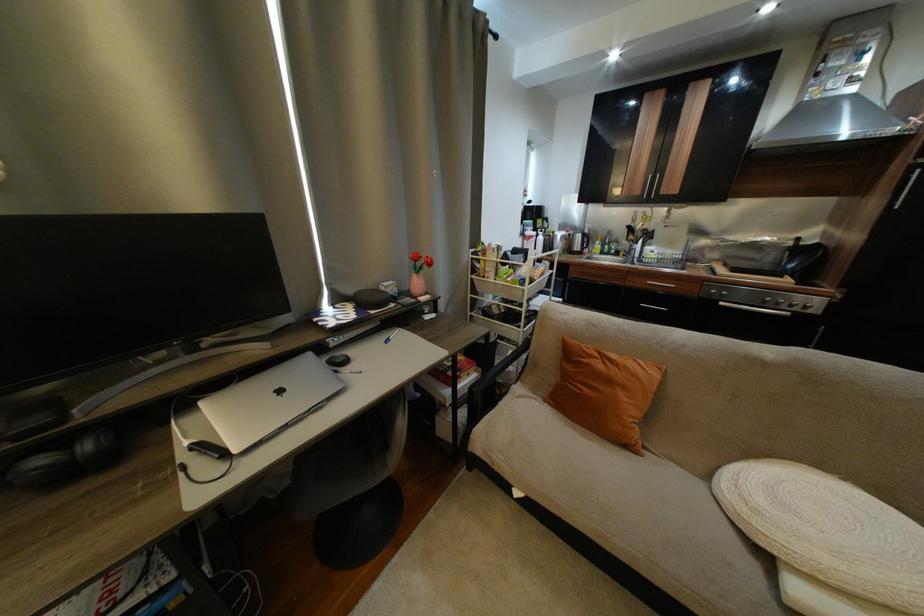
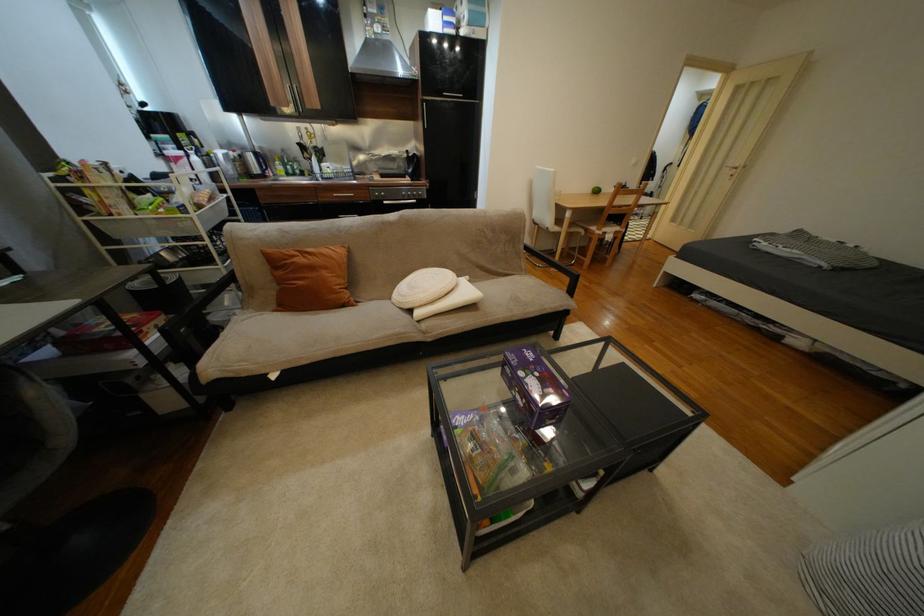
Based on the continuous images, in which direction is the camera rotating?

The camera rotated toward right-down.